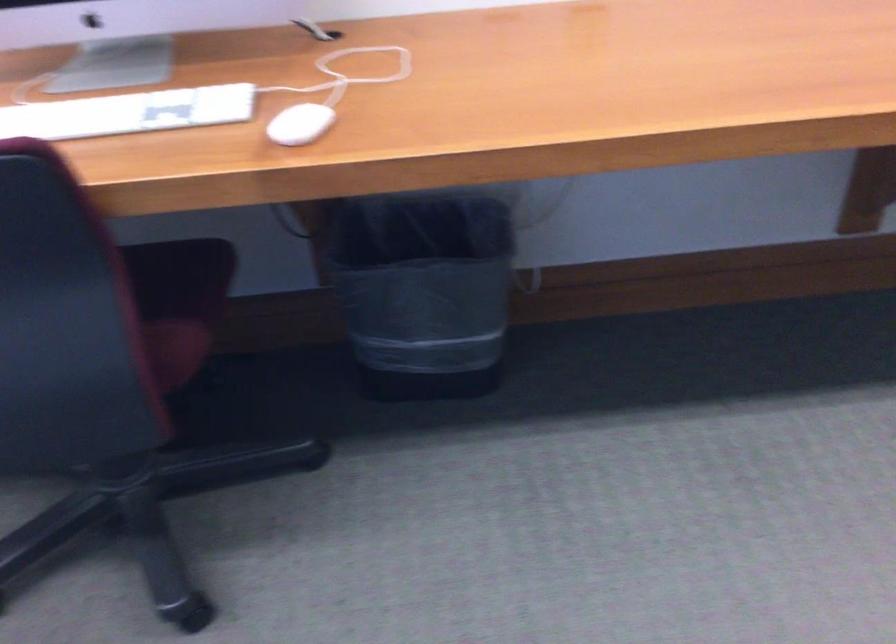
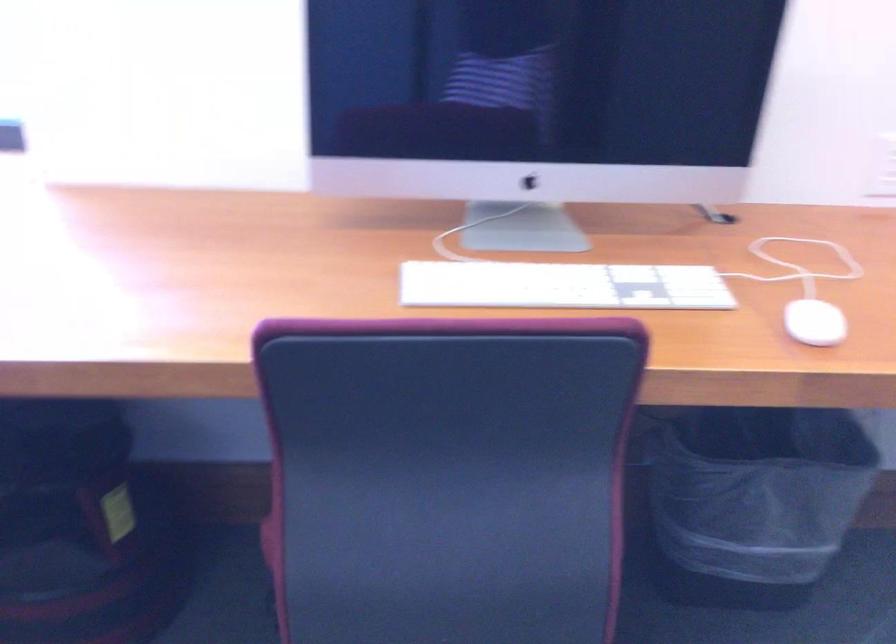
The point at (100,118) is marked in the first image. Where is the corresponding point in the second image?

(562, 285)